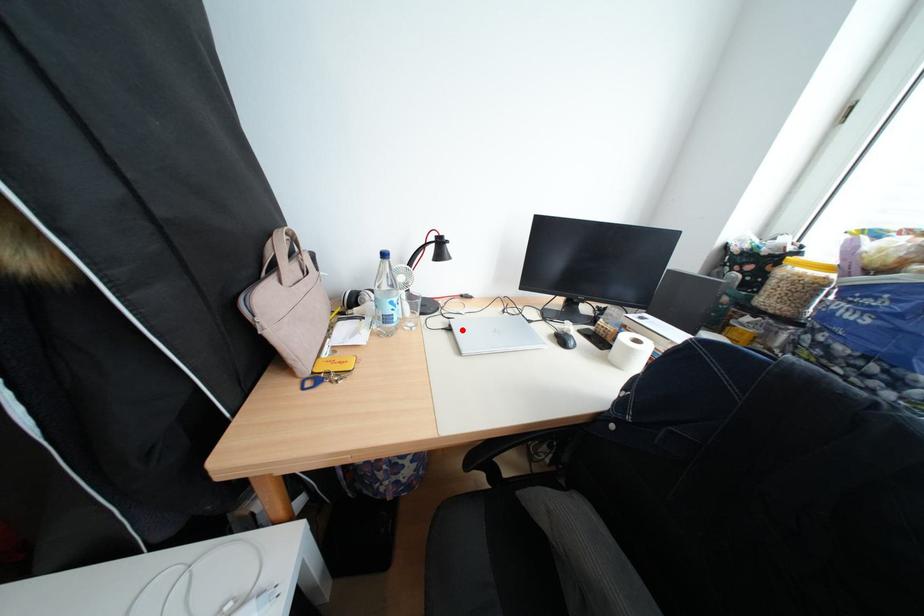
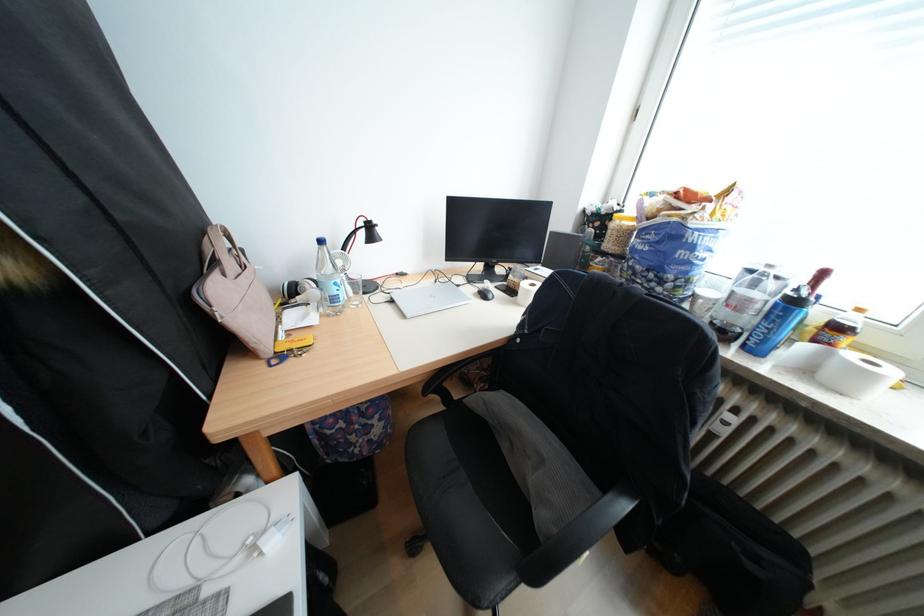
Locate, in the second image, the point that corresponds to the highlighted location in the first image.

(405, 302)